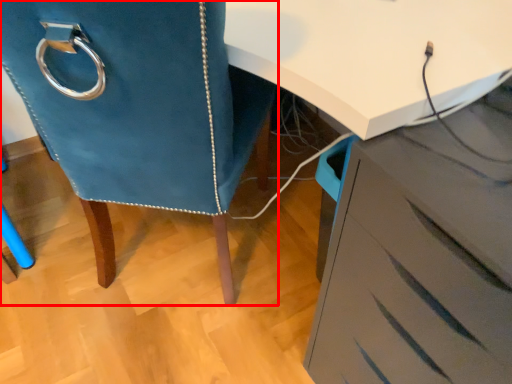
Question: In this image, where is furniture (annotated by the red box) located relative to chest of drawers?

Choices:
 (A) right
 (B) left

Answer: (B)